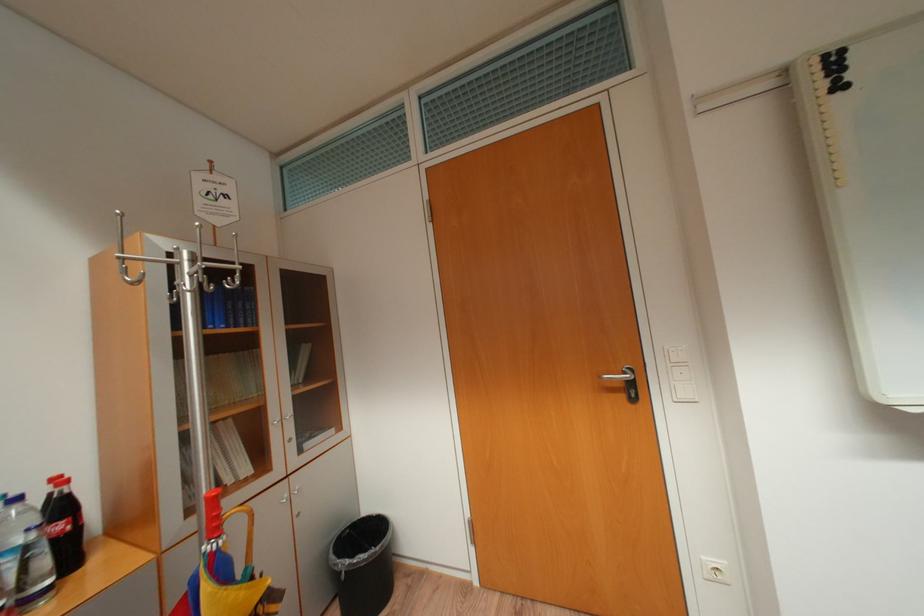
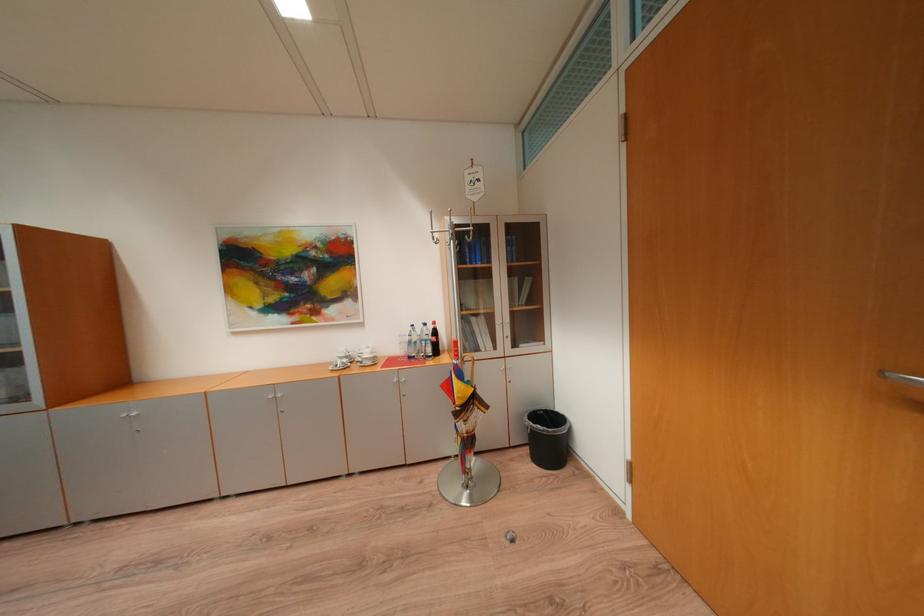
Locate, in the second image, the point that corresponds to the point at 609,378 in the first image.

(891, 374)